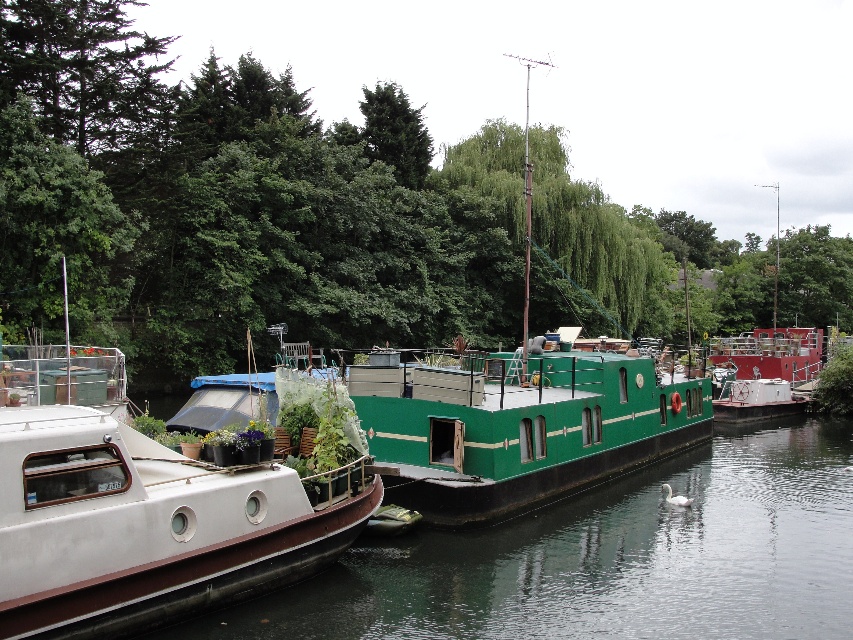
Which is below, green leafy tree at center or white matte boat at left?

white matte boat at left is below.

Is point (708, 328) farther from camera compared to point (62, 468)?

Yes, it is behind point (62, 468).

What are the coordinates of `green leafy tree at center` in the screenshot? It's located at (401, 188).